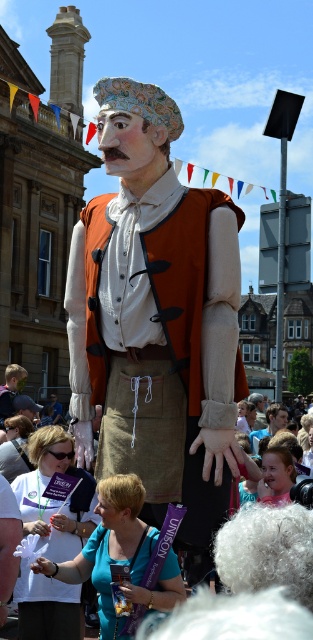
You are a costume designer examining the puppet figure in the scene. You notice the white fabric at center and the blue fabric at lower center. Which fabric is taller?

The white fabric at center is taller than the blue fabric at lower center.

Looking at the scene, which object is positioned higher up between the matte orange vest at center and the blue fabric at lower center?

The matte orange vest at center is positioned above the blue fabric at lower center.

You are an event organizer planning to photograph the matte orange vest at center and the blue fabric at lower center. Which object should you focus on first if you want to capture both in a single frame without moving the camera, considering their sizes?

The matte orange vest at center is taller than the blue fabric at lower center, so focusing on the matte orange vest at center first would ensure both are captured in the frame since it occupies more vertical space.